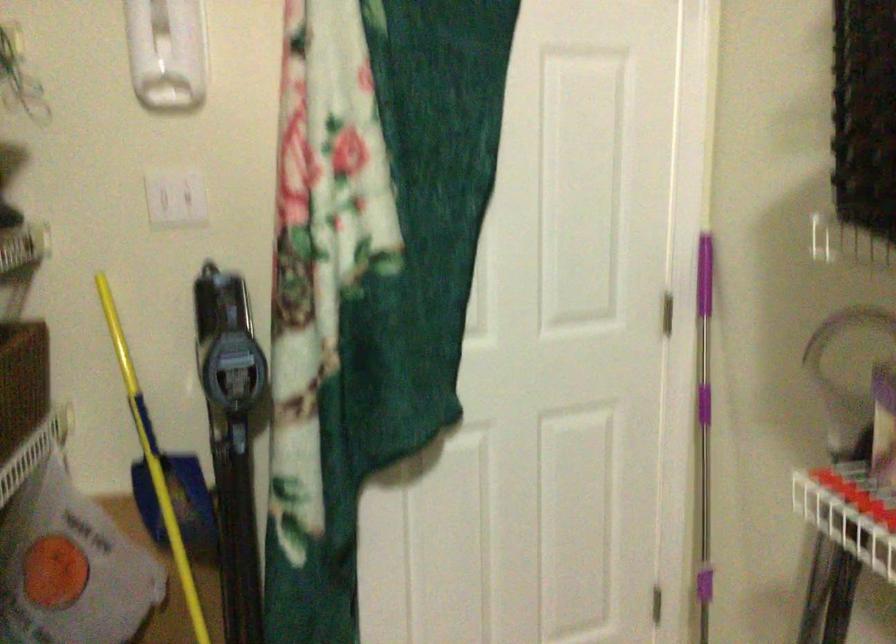
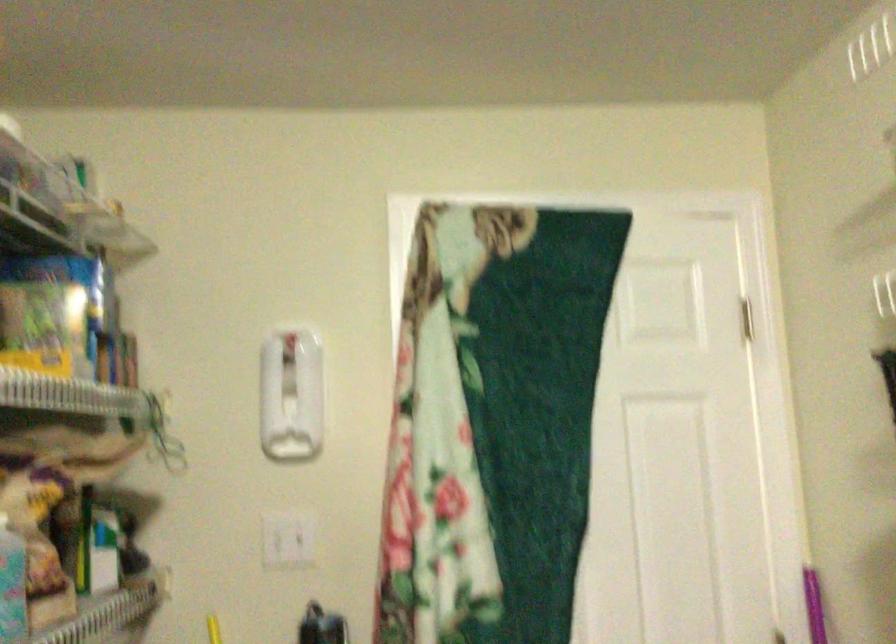
Question: The images are taken continuously from a first-person perspective. In which direction is your viewpoint rotating?

Choices:
 (A) Left
 (B) Right
 (C) Up
 (D) Down

Answer: (C)